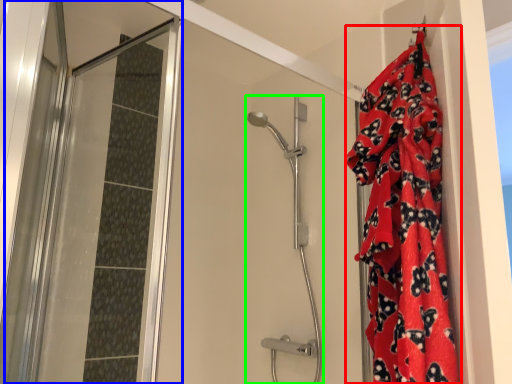
Question: Estimate the real-world distances between objects in this image. Which object is farther from blanket (highlighted by a red box), screen door (highlighted by a blue box) or shower door (highlighted by a green box)?

Choices:
 (A) screen door
 (B) shower door

Answer: (A)